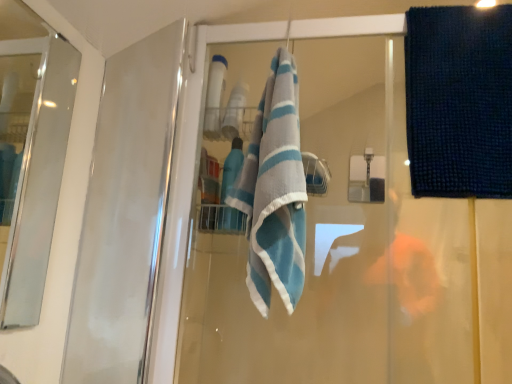
Question: Considering the relative sizes of blue striped towel at center and clear glass screen door at left in the image provided, is blue striped towel at center bigger than clear glass screen door at left?

Choices:
 (A) no
 (B) yes

Answer: (B)

Question: Is the depth of blue striped towel at center greater than that of clear glass screen door at left?

Choices:
 (A) yes
 (B) no

Answer: (A)

Question: Does blue striped towel at center contain clear glass screen door at left?

Choices:
 (A) no
 (B) yes

Answer: (A)

Question: Could you tell me if blue striped towel at center is facing clear glass screen door at left?

Choices:
 (A) yes
 (B) no

Answer: (B)

Question: From a real-world perspective, is blue striped towel at center physically above clear glass screen door at left?

Choices:
 (A) no
 (B) yes

Answer: (B)

Question: Considering the relative sizes of blue striped towel at center and clear glass screen door at left in the image provided, is blue striped towel at center shorter than clear glass screen door at left?

Choices:
 (A) no
 (B) yes

Answer: (B)

Question: From the image's perspective, is dark blue textured towel at upper right over clear glass screen door at left?

Choices:
 (A) yes
 (B) no

Answer: (A)

Question: Considering the relative sizes of dark blue textured towel at upper right and clear glass screen door at left in the image provided, is dark blue textured towel at upper right taller than clear glass screen door at left?

Choices:
 (A) no
 (B) yes

Answer: (A)

Question: Would you say dark blue textured towel at upper right is a long distance from clear glass screen door at left?

Choices:
 (A) yes
 (B) no

Answer: (B)

Question: Can you confirm if dark blue textured towel at upper right is positioned to the right of clear glass screen door at left?

Choices:
 (A) yes
 (B) no

Answer: (A)

Question: From a real-world perspective, is dark blue textured towel at upper right physically above clear glass screen door at left?

Choices:
 (A) no
 (B) yes

Answer: (B)

Question: Can you confirm if dark blue textured towel at upper right is thinner than clear glass screen door at left?

Choices:
 (A) yes
 (B) no

Answer: (B)

Question: Could blue striped towel at center be considered to be inside dark blue textured towel at upper right?

Choices:
 (A) no
 (B) yes

Answer: (A)